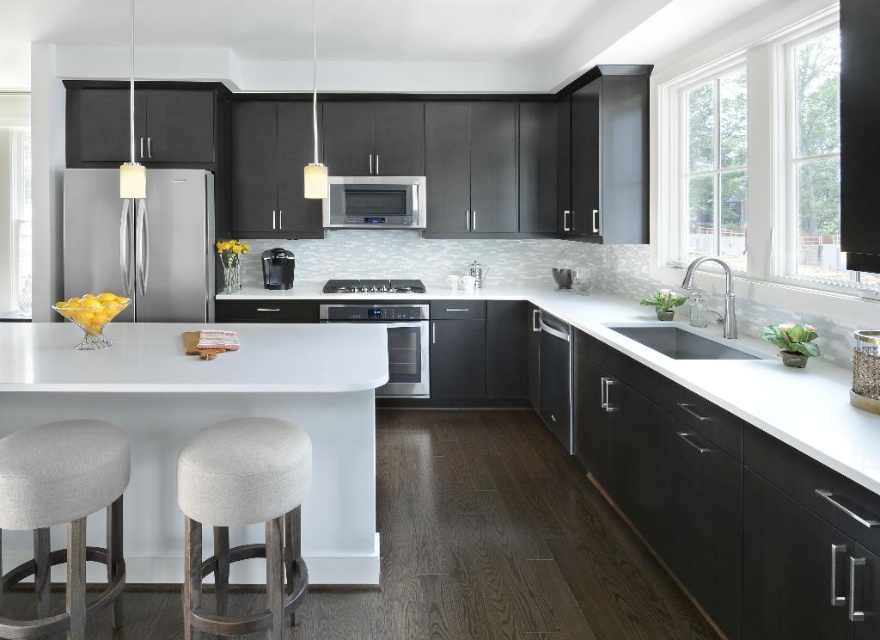
Question: Does white glossy countertop at center appear over black matte stove at center?

Choices:
 (A) yes
 (B) no

Answer: (B)

Question: Which point is closer to the camera?

Choices:
 (A) (189, 560)
 (B) (244, 289)
 (C) (842, 221)

Answer: (C)

Question: Which object appears farthest from the camera in this image?

Choices:
 (A) satin stainless steel refrigerator at left
 (B) satin black coffee maker at center
 (C) beige fabric bar stool at lower left

Answer: (B)

Question: Can you confirm if gray fabric bar stool at lower left is smaller than satin black coffee maker at center?

Choices:
 (A) no
 (B) yes

Answer: (A)

Question: Which object is closer to the camera taking this photo?

Choices:
 (A) satin stainless steel dishwasher at center
 (B) white glossy counter top at center
 (C) black matte window shade at upper right
 (D) satin stainless steel refrigerator at left

Answer: (C)

Question: Can you confirm if white glossy countertop at center is bigger than black matte stove at center?

Choices:
 (A) no
 (B) yes

Answer: (B)